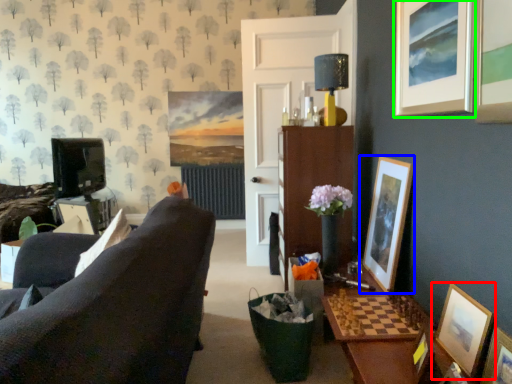
Question: Which object is the closest to the picture frame (highlighted by a red box)? Choose among these: picture frame (highlighted by a blue box) or picture frame (highlighted by a green box).

Choices:
 (A) picture frame
 (B) picture frame

Answer: (A)